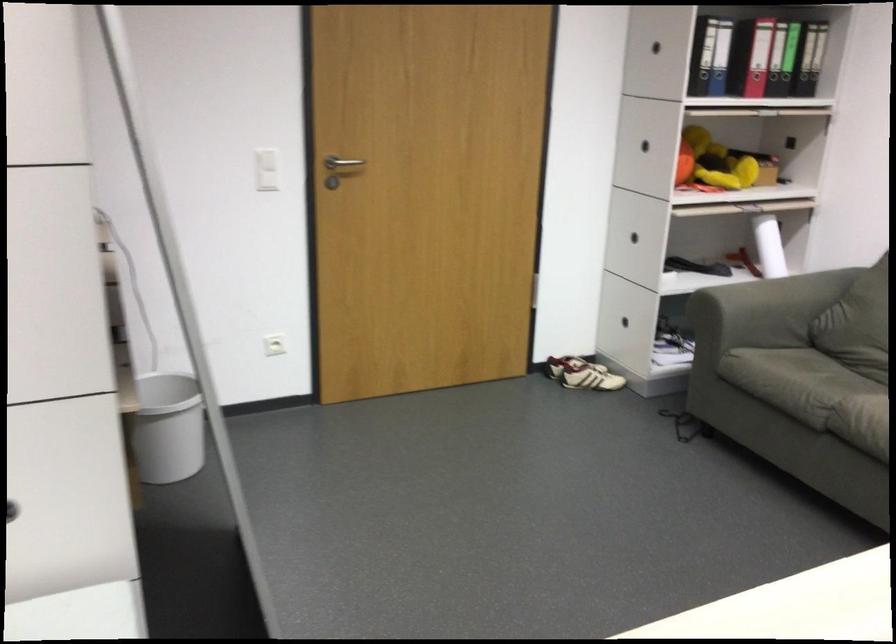
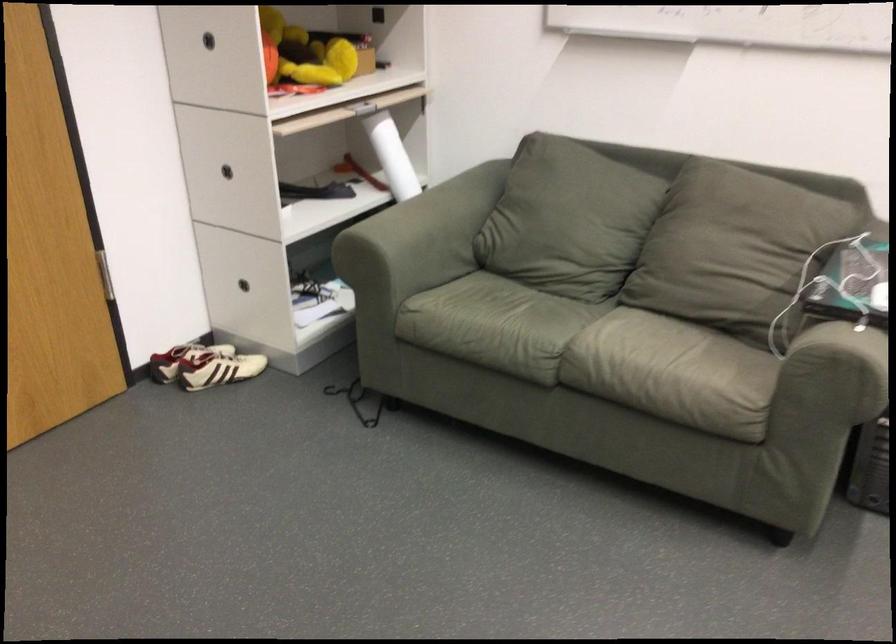
Where in the second image is the point corresponding to (576,373) from the first image?

(218, 368)